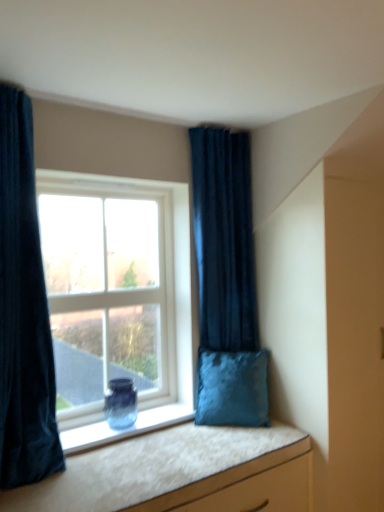
Question: From the image's perspective, does clear glass window at center appear higher than white textured vanity at lower right?

Choices:
 (A) yes
 (B) no

Answer: (A)

Question: Is clear glass window at center next to white textured vanity at lower right?

Choices:
 (A) yes
 (B) no

Answer: (B)

Question: From a real-world perspective, is clear glass window at center over white textured vanity at lower right?

Choices:
 (A) yes
 (B) no

Answer: (A)

Question: Considering the relative sizes of clear glass window at center and white textured vanity at lower right in the image provided, is clear glass window at center wider than white textured vanity at lower right?

Choices:
 (A) no
 (B) yes

Answer: (A)

Question: Considering the relative positions of clear glass window at center and white textured vanity at lower right in the image provided, is clear glass window at center to the right of white textured vanity at lower right from the viewer's perspective?

Choices:
 (A) no
 (B) yes

Answer: (A)

Question: Does clear glass window at center have a larger size compared to white textured vanity at lower right?

Choices:
 (A) yes
 (B) no

Answer: (A)

Question: Does velvet dark blue curtain at left, marked as the 2th curtain in a back-to-front arrangement, contain clear glass window at center?

Choices:
 (A) no
 (B) yes

Answer: (A)

Question: Is velvet dark blue curtain at left, the 1th curtain viewed from the front, in front of clear glass window at center?

Choices:
 (A) yes
 (B) no

Answer: (A)

Question: Is velvet dark blue curtain at left, marked as the 2th curtain in a back-to-front arrangement, looking in the opposite direction of clear glass window at center?

Choices:
 (A) yes
 (B) no

Answer: (B)

Question: Considering the relative sizes of velvet dark blue curtain at left, acting as the first curtain starting from the left, and clear glass window at center in the image provided, is velvet dark blue curtain at left, acting as the first curtain starting from the left, wider than clear glass window at center?

Choices:
 (A) yes
 (B) no

Answer: (A)

Question: Considering the relative sizes of velvet dark blue curtain at left, marked as the 2th curtain in a back-to-front arrangement, and clear glass window at center in the image provided, is velvet dark blue curtain at left, marked as the 2th curtain in a back-to-front arrangement, shorter than clear glass window at center?

Choices:
 (A) no
 (B) yes

Answer: (A)

Question: Does velvet dark blue curtain at left, marked as the 2th curtain in a back-to-front arrangement, turn towards clear glass window at center?

Choices:
 (A) yes
 (B) no

Answer: (B)

Question: Considering the relative sizes of white textured vanity at lower right and blue glass vase at window in the image provided, is white textured vanity at lower right bigger than blue glass vase at window?

Choices:
 (A) no
 (B) yes

Answer: (B)